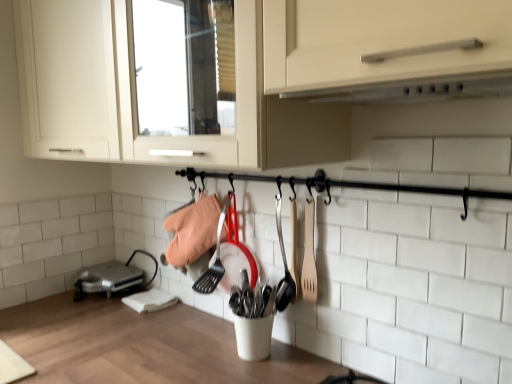
Question: Considering their positions, is wooden spoon at center-right located in front of or behind wooden spatula at center-right?

Choices:
 (A) front
 (B) behind

Answer: (B)

Question: Visually, is wooden spoon at center-right positioned to the left or to the right of wooden spatula at center-right?

Choices:
 (A) left
 (B) right

Answer: (A)

Question: Estimate the real-world distances between objects in this image. Which object is farther from the silver metallic toaster at lower left?

Choices:
 (A) white matte exhaust hood at upper center
 (B) wooden spoon at center-right
 (C) white wood countertop at center
 (D) wooden spatula at center-right

Answer: (A)

Question: Which is nearer to the white wood countertop at center?

Choices:
 (A) wooden spatula at center-right
 (B) silver metallic toaster at lower left
 (C) wooden spoon at center-right
 (D) white matte exhaust hood at upper center

Answer: (B)